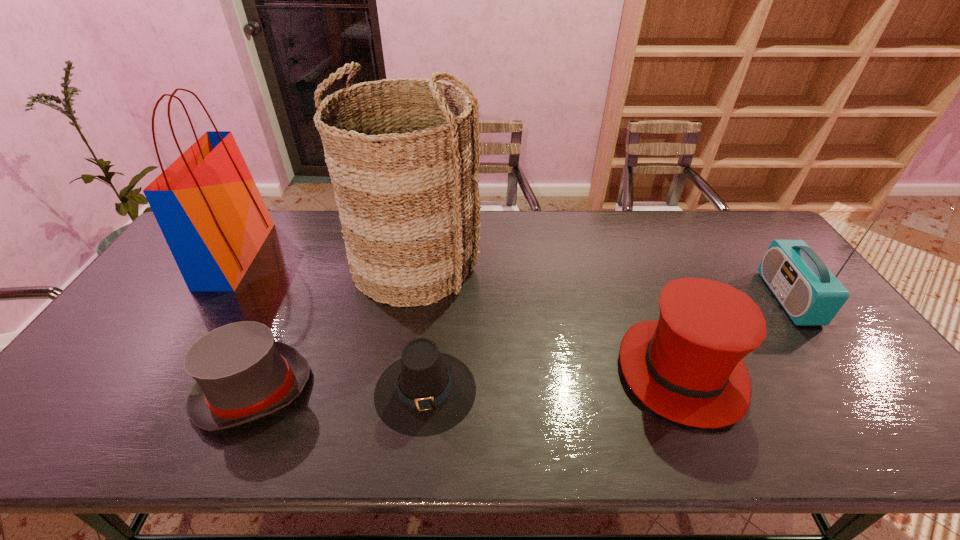
Image resolution: width=960 pixels, height=540 pixels. Identify the location of vacant space located 0.080m on the front panel of the rightmost object. [744, 298].

Find the location of `vacant region located 0.170m on the front panel of the rightmost object`. vacant region located 0.170m on the front panel of the rightmost object is located at coordinates (713, 298).

Where is `blank space located 0.150m on the front panel of the rightmost object`? This screenshot has height=540, width=960. blank space located 0.150m on the front panel of the rightmost object is located at coordinates (720, 298).

Locate an element on the screen. The image size is (960, 540). free space located 0.280m on the right of the rightmost hat is located at coordinates (855, 371).

The image size is (960, 540). I want to click on vacant region located 0.280m on the right of the leftmost hat, so click(x=424, y=390).

You are a GUI agent. You are given a task and a screenshot of the screen. Output one action in this format:
    pyautogui.click(x=<x>, y=<y>)
    Task: Click on the basket present at the far edge
    The width and height of the screenshot is (960, 540).
    Given the screenshot: What is the action you would take?
    pyautogui.click(x=400, y=152)

Locate an element on the screen. shopping bag at the far edge is located at coordinates (207, 205).

Where is `object at the left edge`? object at the left edge is located at coordinates (207, 205).

Locate an element on the screen. Image resolution: width=960 pixels, height=540 pixels. object that is positioned at the right edge is located at coordinates (810, 293).

The image size is (960, 540). I want to click on object that is at the far left corner, so (x=207, y=205).